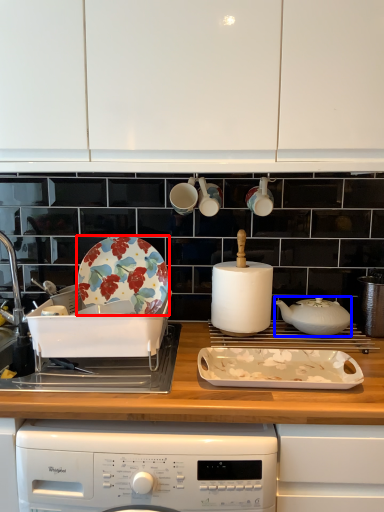
Question: Which point is further to the camera, plate (highlighted by a red box) or kitchen appliance (highlighted by a blue box)?

Choices:
 (A) plate
 (B) kitchen appliance

Answer: (A)